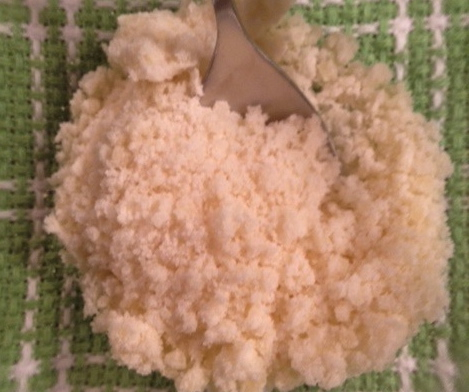
Where is `tip of spoon`? The height and width of the screenshot is (392, 469). tip of spoon is located at coordinates (275, 112).